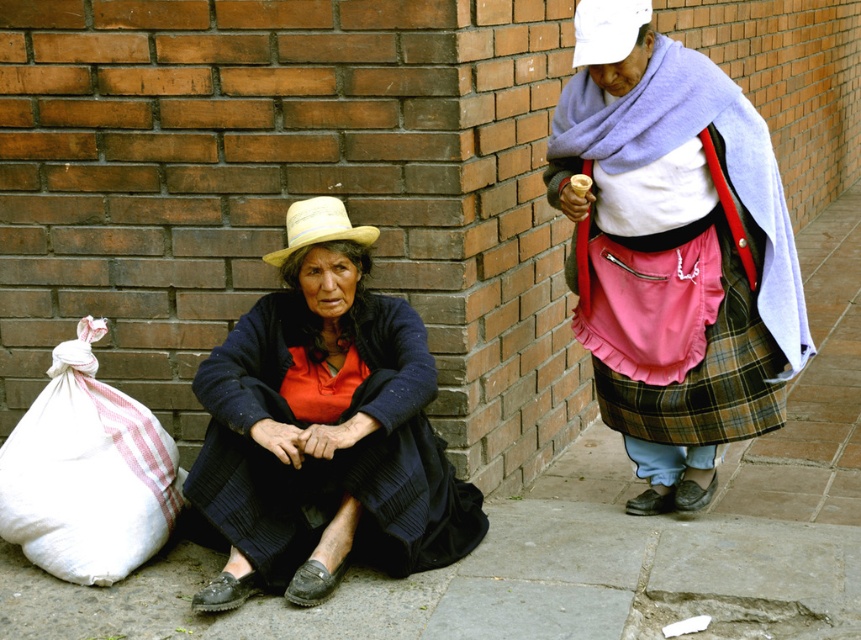
Which is more to the left, knitted dark blue sweater at lower left or white woven bag at lower left?

white woven bag at lower left is more to the left.

Between knitted dark blue sweater at lower left and white woven bag at lower left, which one is positioned lower?

white woven bag at lower left is lower down.

Does point (438, 522) lie in front of point (60, 444)?

No, (438, 522) is behind (60, 444).

The width and height of the screenshot is (861, 640). I want to click on knitted dark blue sweater at lower left, so click(x=324, y=428).

Which is more to the right, white fabric hat at upper center or straw woven cowboy hat at lower left?

From the viewer's perspective, white fabric hat at upper center appears more on the right side.

At what (x,y) coordinates should I click in order to perform the action: click on white fabric hat at upper center. Please return your answer as a coordinate pair (x, y). The image size is (861, 640). Looking at the image, I should click on (606, 29).

Is plaid skirt at center to the right of white woven bag at lower left from the viewer's perspective?

Indeed, plaid skirt at center is positioned on the right side of white woven bag at lower left.

Is point (778, 420) less distant than point (174, 508)?

That is False.

Is point (568, 147) behind point (146, 531)?

That is True.

The width and height of the screenshot is (861, 640). Find the location of `plaid skirt at center`. plaid skirt at center is located at coordinates (678, 262).